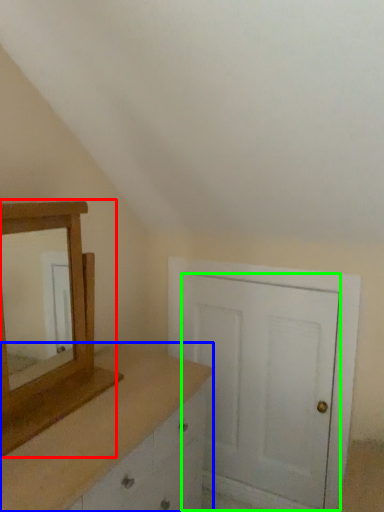
Question: Based on their relative distances, which object is nearer to medicine cabinet (highlighted by a red box)? Choose from chest of drawers (highlighted by a blue box) and door (highlighted by a green box).

Choices:
 (A) chest of drawers
 (B) door

Answer: (A)